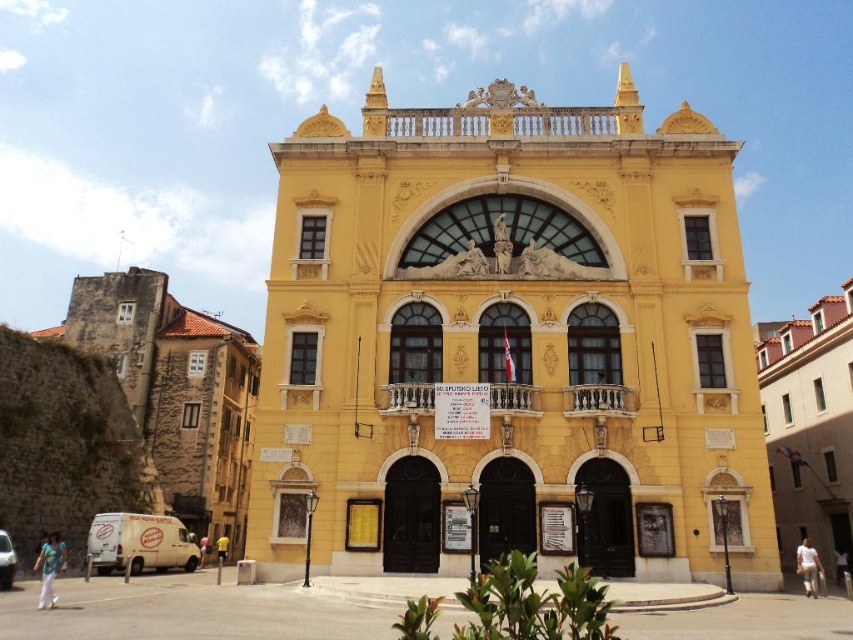
Question: Is brown stone wall at left above white cotton shirt at lower right?

Choices:
 (A) no
 (B) yes

Answer: (B)

Question: Is yellow matte building at center to the right of yellow fabric person at lower center from the viewer's perspective?

Choices:
 (A) yes
 (B) no

Answer: (A)

Question: Is brown stone wall at left wider than yellow fabric person at lower center?

Choices:
 (A) no
 (B) yes

Answer: (B)

Question: Which object appears closest to the camera in this image?

Choices:
 (A) light blue fabric shirt at lower left
 (B) white cotton shirt at lower right
 (C) brown stone wall at left
 (D) yellow matte building at center

Answer: (A)

Question: Which object is closer to the camera taking this photo?

Choices:
 (A) yellow matte building at right
 (B) yellow fabric person at lower center
 (C) yellow fabric shirt at center
 (D) white cotton shirt at lower right

Answer: (A)

Question: Among these points, which one is nearest to the camera?

Choices:
 (A) (815, 560)
 (B) (753, 435)
 (C) (200, 557)
 (D) (219, 536)

Answer: (A)